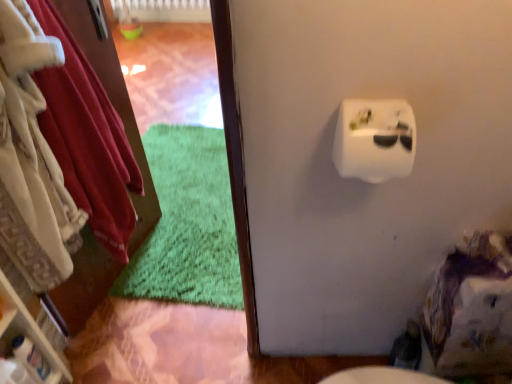
Question: Does velvety white robe at left come behind white plastic shelf at left?

Choices:
 (A) yes
 (B) no

Answer: (B)

Question: Considering the relative positions of velvety white robe at left and white plastic shelf at left in the image provided, is velvety white robe at left in front of white plastic shelf at left?

Choices:
 (A) yes
 (B) no

Answer: (A)

Question: From the image's perspective, is velvety white robe at left beneath white plastic shelf at left?

Choices:
 (A) yes
 (B) no

Answer: (B)

Question: From a real-world perspective, is velvety white robe at left over white plastic shelf at left?

Choices:
 (A) no
 (B) yes

Answer: (B)

Question: From the image's perspective, would you say velvety white robe at left is positioned over white plastic shelf at left?

Choices:
 (A) no
 (B) yes

Answer: (B)

Question: From a real-world perspective, is velvety white robe at left physically located above or below white plastic toilet paper at upper right?

Choices:
 (A) below
 (B) above

Answer: (A)

Question: Is velvety white robe at left bigger or smaller than white plastic toilet paper at upper right?

Choices:
 (A) small
 (B) big

Answer: (B)

Question: Would you say velvety white robe at left is inside or outside white plastic toilet paper at upper right?

Choices:
 (A) inside
 (B) outside

Answer: (B)

Question: In terms of width, does velvety white robe at left look wider or thinner when compared to white plastic toilet paper at upper right?

Choices:
 (A) thin
 (B) wide

Answer: (B)

Question: Do you think white plastic shelf at left is within velvety white robe at left, or outside of it?

Choices:
 (A) outside
 (B) inside

Answer: (A)

Question: In terms of width, does white plastic shelf at left look wider or thinner when compared to velvety white robe at left?

Choices:
 (A) thin
 (B) wide

Answer: (A)

Question: Is white plastic shelf at left taller or shorter than velvety white robe at left?

Choices:
 (A) tall
 (B) short

Answer: (B)

Question: From the image's perspective, is white plastic shelf at left above or below velvety white robe at left?

Choices:
 (A) below
 (B) above

Answer: (A)

Question: From the image's perspective, is white plastic shelf at left above or below white plastic toilet paper at upper right?

Choices:
 (A) above
 (B) below

Answer: (B)

Question: Does point (3, 332) appear closer or farther from the camera than point (371, 180)?

Choices:
 (A) closer
 (B) farther

Answer: (B)